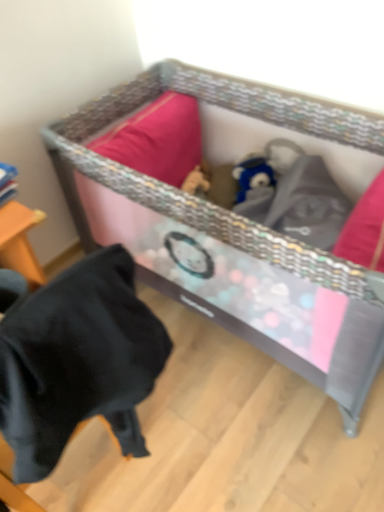
Locate an element on the screen. The width and height of the screenshot is (384, 512). vacant space underneath black fabric at lower left (from a real-world perspective) is located at coordinates (90, 472).